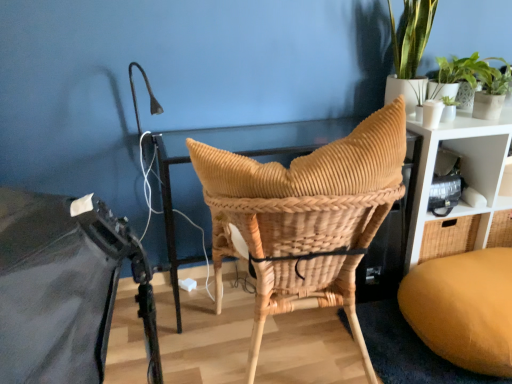
Question: In terms of width, does velvet mustard bean bag at lower right look wider or thinner when compared to woven rattan basket at center?

Choices:
 (A) wide
 (B) thin

Answer: (A)

Question: Is velvet mustard bean bag at lower right situated inside woven rattan basket at center or outside?

Choices:
 (A) outside
 (B) inside

Answer: (A)

Question: Estimate the real-world distances between objects in this image. Which object is farther from the green leafy plant at upper right, which is counted as the 2th houseplant, starting from the right?

Choices:
 (A) natural woven chair at center
 (B) velvet mustard bean bag at lower right
 (C) white matte shelf at right, the first shelf viewed from the top
 (D) white woven shelf at upper right, the 1th shelf when ordered from bottom to top
 (E) woven rattan basket at center

Answer: (B)

Question: Estimate the real-world distances between objects in this image. Which object is farther from the green leafy plant at upper right, which is counted as the 2th houseplant, starting from the right?

Choices:
 (A) woven rattan basket at center
 (B) white woven shelf at upper right, marked as the second shelf in a top-to-bottom arrangement
 (C) white matte shelf at right, the first shelf viewed from the top
 (D) natural woven chair at center
 (E) velvet mustard bean bag at lower right

Answer: (E)